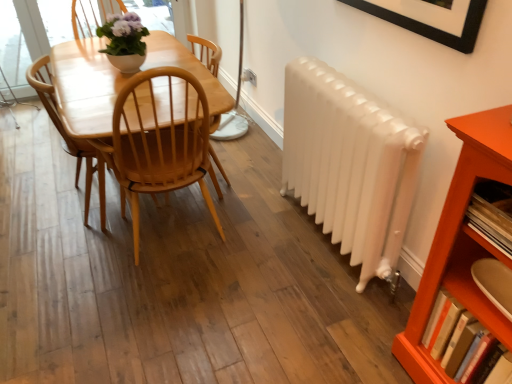
Locate an element on the screen. The height and width of the screenshot is (384, 512). vacant area situated to the left side of white glossy radiator at right is located at coordinates (257, 253).